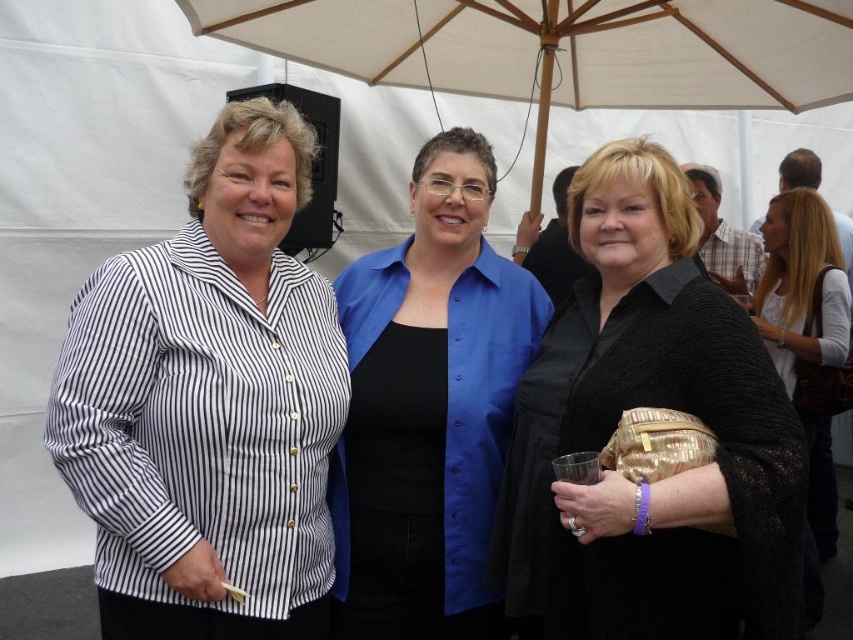
Between white striped shirt at center and blonde hair at upper right, which one has less height?

white striped shirt at center is shorter.

Who is more distant from viewer, [181,346] or [773,314]?

Point [773,314]

The width and height of the screenshot is (853, 640). Identify the location of white striped shirt at center. (209, 403).

What do you see at coordinates (209, 403) in the screenshot? This screenshot has width=853, height=640. I see `white striped shirt at center` at bounding box center [209, 403].

At what (x,y) coordinates should I click in order to perform the action: click on white striped shirt at center. Please return your answer as a coordinate pair (x, y). The height and width of the screenshot is (640, 853). Looking at the image, I should click on (209, 403).

Is black textured sweater at center thinner than blue satin blouse at center?

Yes, black textured sweater at center is thinner than blue satin blouse at center.

Between black textured sweater at center and blue satin blouse at center, which one has less height?

With less height is black textured sweater at center.

The height and width of the screenshot is (640, 853). Identify the location of black textured sweater at center. (650, 406).